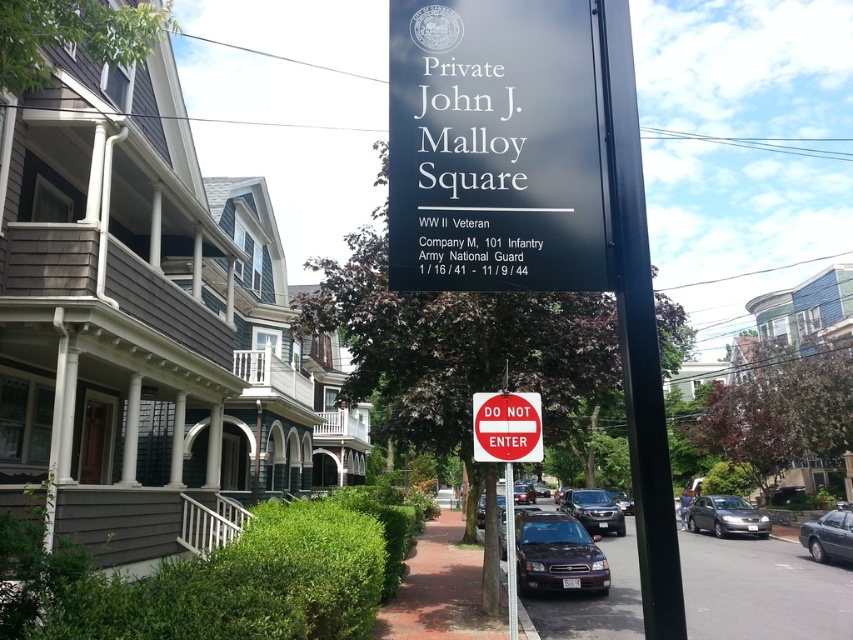
Based on the photo, how far apart are satin black suv at center and black metal pole at center?

They are 20.71 meters apart.

Which is below, satin black suv at center or black metal pole at center?

Positioned lower is satin black suv at center.

You are a GUI agent. You are given a task and a screenshot of the screen. Output one action in this format:
    pyautogui.click(x=<x>, y=<y>)
    Task: Click on the satin black suv at center
    The image size is (853, 640).
    Given the screenshot: What is the action you would take?
    pos(593,509)

Identify the location of satin black suv at center. (593, 509).

Is satin black sedan at center shorter than shiny black sedan at center?

Correct, satin black sedan at center is not as tall as shiny black sedan at center.

Is satin black sedan at center to the right of shiny black sedan at center from the viewer's perspective?

Incorrect, satin black sedan at center is not on the right side of shiny black sedan at center.

This screenshot has height=640, width=853. Describe the element at coordinates (556, 554) in the screenshot. I see `satin black sedan at center` at that location.

I want to click on satin black sedan at center, so click(x=556, y=554).

Between metallic gray sedan at lower right and shiny black sedan at center, which one is positioned lower?

shiny black sedan at center

Is point (846, 529) positioned before point (515, 490)?

Yes, point (846, 529) is closer to viewer.

Image resolution: width=853 pixels, height=640 pixels. Identify the location of metallic gray sedan at lower right. (828, 536).